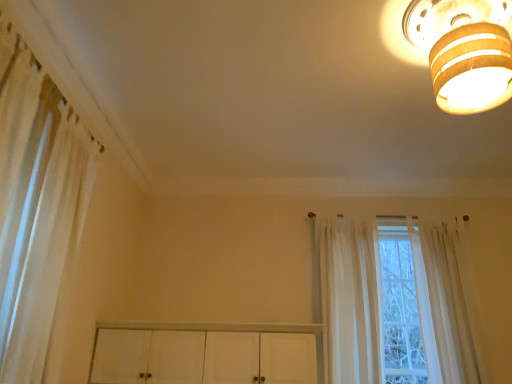
Question: From the image's perspective, is wooden ceiling light at upper right located above sheer white curtain at center, which appears as the 2th curtain when viewed from the right?

Choices:
 (A) yes
 (B) no

Answer: (A)

Question: Could you tell me if wooden ceiling light at upper right is facing sheer white curtain at center, which appears as the 2th curtain when viewed from the right?

Choices:
 (A) yes
 (B) no

Answer: (B)

Question: Does wooden ceiling light at upper right have a larger size compared to sheer white curtain at center, which appears as the 2th curtain when viewed from the right?

Choices:
 (A) no
 (B) yes

Answer: (A)

Question: From a real-world perspective, does wooden ceiling light at upper right sit lower than sheer white curtain at center, which appears as the 2th curtain when viewed from the right?

Choices:
 (A) yes
 (B) no

Answer: (B)

Question: Considering the relative sizes of wooden ceiling light at upper right and sheer white curtain at center, which appears as the 2th curtain when viewed from the right, in the image provided, is wooden ceiling light at upper right smaller than sheer white curtain at center, which appears as the 2th curtain when viewed from the right,?

Choices:
 (A) no
 (B) yes

Answer: (B)

Question: Looking at their shapes, would you say white sheer curtain at left, marked as the third curtain in a right-to-left arrangement, is wider or thinner than wooden ceiling light at upper right?

Choices:
 (A) thin
 (B) wide

Answer: (A)

Question: Considering the positions of white sheer curtain at left, marked as the third curtain in a right-to-left arrangement, and wooden ceiling light at upper right in the image, is white sheer curtain at left, marked as the third curtain in a right-to-left arrangement, taller or shorter than wooden ceiling light at upper right?

Choices:
 (A) tall
 (B) short

Answer: (A)

Question: From the image's perspective, is white sheer curtain at left, marked as the third curtain in a right-to-left arrangement, positioned above or below wooden ceiling light at upper right?

Choices:
 (A) below
 (B) above

Answer: (A)

Question: Would you say white sheer curtain at left, placed as the 1th curtain when sorted from left to right, is to the left or to the right of wooden ceiling light at upper right in the picture?

Choices:
 (A) left
 (B) right

Answer: (A)

Question: Considering the positions of wooden ceiling light at upper right and white sheer curtain at left, marked as the third curtain in a right-to-left arrangement, in the image, is wooden ceiling light at upper right wider or thinner than white sheer curtain at left, marked as the third curtain in a right-to-left arrangement,?

Choices:
 (A) thin
 (B) wide

Answer: (B)

Question: From a real-world perspective, is wooden ceiling light at upper right physically located above or below white sheer curtain at left, marked as the third curtain in a right-to-left arrangement?

Choices:
 (A) above
 (B) below

Answer: (A)

Question: Based on their positions, is wooden ceiling light at upper right located to the left or right of white sheer curtain at left, placed as the 1th curtain when sorted from left to right?

Choices:
 (A) right
 (B) left

Answer: (A)

Question: Considering the positions of wooden ceiling light at upper right and white sheer curtain at left, placed as the 1th curtain when sorted from left to right, in the image, is wooden ceiling light at upper right taller or shorter than white sheer curtain at left, placed as the 1th curtain when sorted from left to right,?

Choices:
 (A) short
 (B) tall

Answer: (A)

Question: In terms of height, does wooden ceiling light at upper right look taller or shorter compared to sheer white curtain at center, positioned as the 2th curtain in left-to-right order?

Choices:
 (A) short
 (B) tall

Answer: (A)

Question: Looking at the image, does wooden ceiling light at upper right seem bigger or smaller compared to sheer white curtain at center, which appears as the 2th curtain when viewed from the right?

Choices:
 (A) small
 (B) big

Answer: (A)